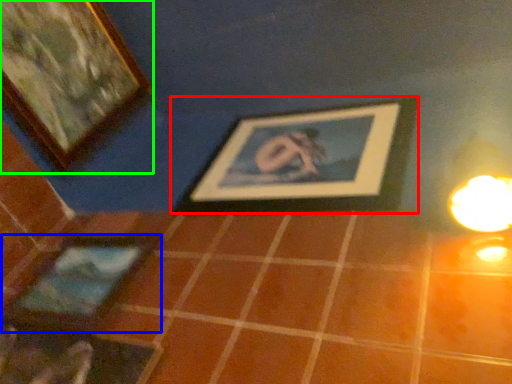
Question: Which is farther away from picture frame (highlighted by a red box)? picture frame (highlighted by a blue box) or picture frame (highlighted by a green box)?

Choices:
 (A) picture frame
 (B) picture frame

Answer: (B)